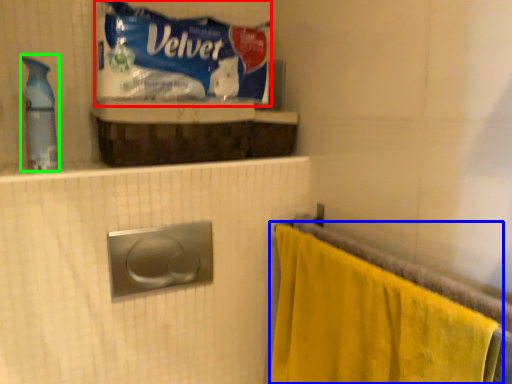
Question: Which object is the closest to the material (highlighted by a red box)? Choose among these: towel (highlighted by a blue box) or cleaning product (highlighted by a green box).

Choices:
 (A) towel
 (B) cleaning product

Answer: (B)